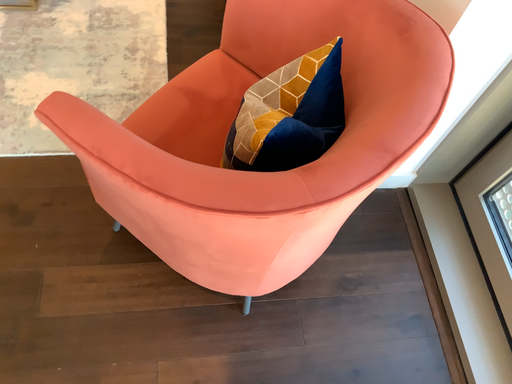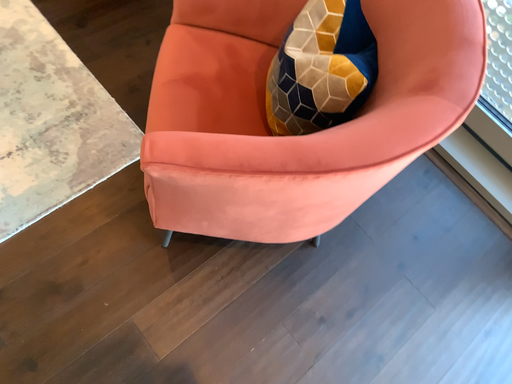
Question: How did the camera likely rotate when shooting the video?

Choices:
 (A) rotated left
 (B) rotated right

Answer: (B)